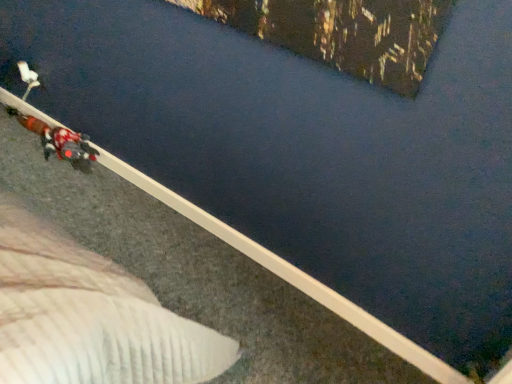
Measure the distance between velvet-like red coat at lower left and camera.

velvet-like red coat at lower left and camera are 6.59 feet apart.

The width and height of the screenshot is (512, 384). I want to click on velvet-like red coat at lower left, so click(x=60, y=142).

The height and width of the screenshot is (384, 512). What do you see at coordinates (60, 142) in the screenshot?
I see `velvet-like red coat at lower left` at bounding box center [60, 142].

Describe the element at coordinates (28, 78) in the screenshot. The image size is (512, 384). I see `white plush toy at upper left` at that location.

At what (x,y) coordinates should I click in order to perform the action: click on white plush toy at upper left. Please return your answer as a coordinate pair (x, y). This screenshot has width=512, height=384. Looking at the image, I should click on (28, 78).

This screenshot has width=512, height=384. Identify the location of velvet-like red coat at lower left. (60, 142).

Is white plush toy at upper left to the right of velvet-like red coat at lower left from the viewer's perspective?

No.

Is white plush toy at upper left behind velvet-like red coat at lower left?

That is True.

Is point (22, 97) more distant than point (90, 150)?

Yes.

Consider the image. From the image's perspective, is white plush toy at upper left positioned above or below velvet-like red coat at lower left?

From the image's perspective, white plush toy at upper left appears above velvet-like red coat at lower left.

From a real-world perspective, between white plush toy at upper left and velvet-like red coat at lower left, who is vertically lower?

In real-world perspective, velvet-like red coat at lower left is lower.

Is white plush toy at upper left wider or thinner than velvet-like red coat at lower left?

In the image, white plush toy at upper left appears to be more narrow than velvet-like red coat at lower left.

Is white plush toy at upper left taller or shorter than velvet-like red coat at lower left?

Clearly, white plush toy at upper left is shorter compared to velvet-like red coat at lower left.

Is white plush toy at upper left smaller than velvet-like red coat at lower left?

Yes.

Does white plush toy at upper left contain velvet-like red coat at lower left?

Definitely not — velvet-like red coat at lower left is not inside white plush toy at upper left.

Is white plush toy at upper left not near velvet-like red coat at lower left?

No.

Is white plush toy at upper left oriented away from velvet-like red coat at lower left?

No, white plush toy at upper left is not facing the opposite direction of velvet-like red coat at lower left.

What's the angular difference between white plush toy at upper left and velvet-like red coat at lower left's facing directions?

The facing directions of white plush toy at upper left and velvet-like red coat at lower left are 2.71 degrees apart.

You are a GUI agent. You are given a task and a screenshot of the screen. Output one action in this format:
    pyautogui.click(x=<x>, y=<y>)
    Task: Click on the toy behind the velvet-like red coat at lower left
    
    Given the screenshot: What is the action you would take?
    pyautogui.click(x=28, y=78)

Considering the relative positions of velvet-like red coat at lower left and white plush toy at upper left in the image provided, is velvet-like red coat at lower left to the left or to the right of white plush toy at upper left?

velvet-like red coat at lower left is to the right of white plush toy at upper left.

Is velvet-like red coat at lower left in front of white plush toy at upper left?

Yes.

Is point (72, 144) positioned in front of point (23, 66)?

No, it is behind (23, 66).

From the image's perspective, which one is positioned lower, velvet-like red coat at lower left or white plush toy at upper left?

velvet-like red coat at lower left, from the image's perspective.

From a real-world perspective, is velvet-like red coat at lower left below white plush toy at upper left?

Yes, from a real-world perspective, velvet-like red coat at lower left is beneath white plush toy at upper left.

Is velvet-like red coat at lower left wider than white plush toy at upper left?

Yes.

Who is taller, velvet-like red coat at lower left or white plush toy at upper left?

velvet-like red coat at lower left is taller.

Does velvet-like red coat at lower left have a larger size compared to white plush toy at upper left?

Yes.

From the picture: Does velvet-like red coat at lower left contain white plush toy at upper left?

No, white plush toy at upper left is not a part of velvet-like red coat at lower left.

Is velvet-like red coat at lower left beside white plush toy at upper left?

No.

Consider the image. Is velvet-like red coat at lower left oriented away from white plush toy at upper left?

No, velvet-like red coat at lower left is not facing away from white plush toy at upper left.

The height and width of the screenshot is (384, 512). I want to click on person lying on the right of white plush toy at upper left, so click(60, 142).

Locate an element on the screen. person on the right of white plush toy at upper left is located at coordinates (x=60, y=142).

This screenshot has height=384, width=512. In the image, there is a white plush toy at upper left. What are the coordinates of `person below it (from a real-world perspective)` in the screenshot? It's located at (60, 142).